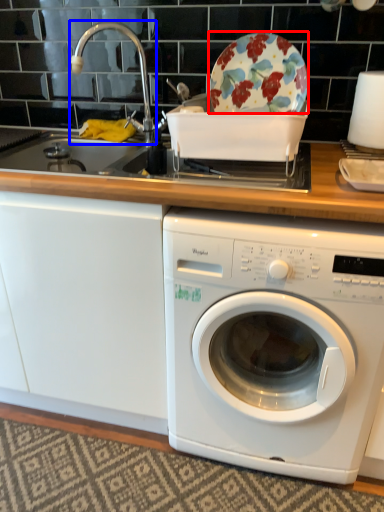
Question: Which object is further to the camera taking this photo, table (highlighted by a red box) or faucet (highlighted by a blue box)?

Choices:
 (A) table
 (B) faucet

Answer: (B)